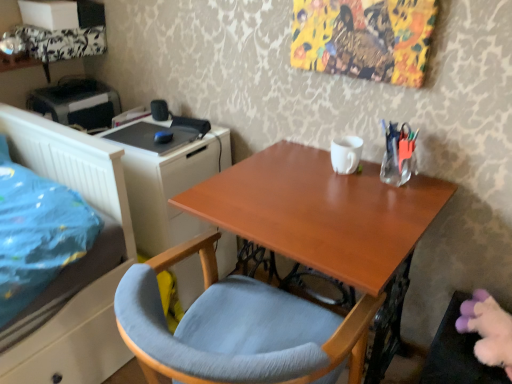
Where is `free location to the left of clear glass vase at upper right`? free location to the left of clear glass vase at upper right is located at coordinates (335, 186).